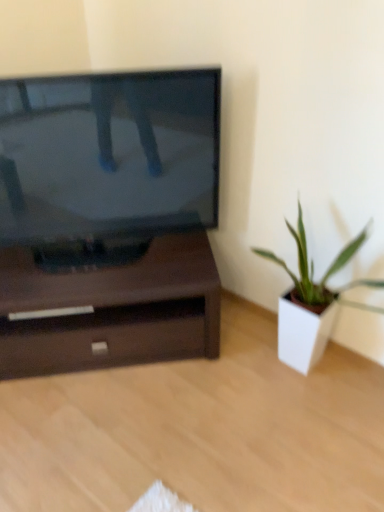
In order to click on blank space to the left of green matte plant at right in this screenshot , I will do `click(226, 400)`.